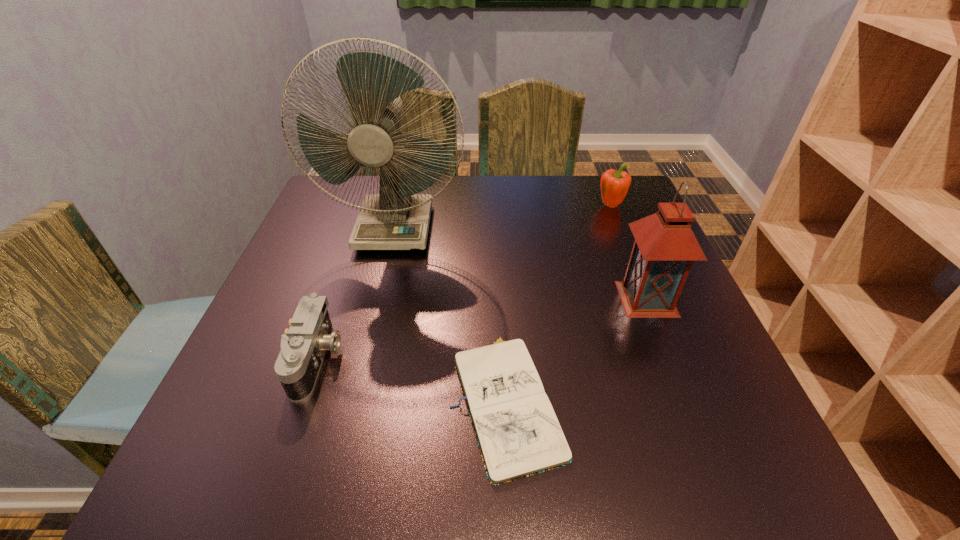
At what (x,y) coordinates should I click in order to perform the action: click on the tallest object. Please return your answer as a coordinate pair (x, y). Looking at the image, I should click on (397, 218).

This screenshot has height=540, width=960. I want to click on the third nearest object, so click(x=665, y=247).

This screenshot has height=540, width=960. I want to click on the second tallest object, so click(x=665, y=247).

Locate an element on the screen. The height and width of the screenshot is (540, 960). pepper is located at coordinates (614, 185).

At what (x,y) coordinates should I click in order to perform the action: click on camera. Please return your answer as a coordinate pair (x, y). The width and height of the screenshot is (960, 540). Looking at the image, I should click on (303, 346).

Where is `notebook`? The height and width of the screenshot is (540, 960). notebook is located at coordinates (517, 431).

This screenshot has height=540, width=960. Identify the location of free location located 0.310m on the front-facing side of the tallest object. (363, 360).

Where is `free space located 0.390m on the left of the fourth shortest object`? free space located 0.390m on the left of the fourth shortest object is located at coordinates (438, 299).

Where is `vacant space positioned on the left of the pepper`? This screenshot has width=960, height=540. vacant space positioned on the left of the pepper is located at coordinates tap(506, 206).

Identify the location of vacant space located on the lens of the camera. (468, 359).